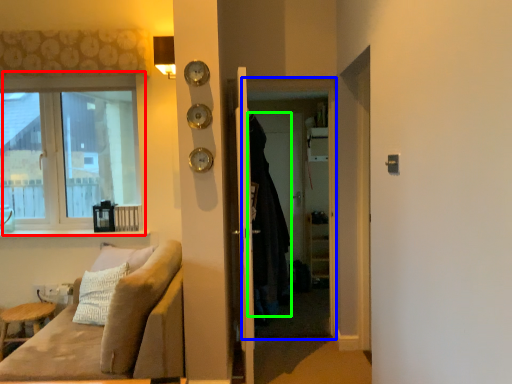
Question: Which object is the closest to the window (highlighted by a red box)? Choose among these: screen door (highlighted by a blue box) or cloak (highlighted by a green box).

Choices:
 (A) screen door
 (B) cloak

Answer: (A)